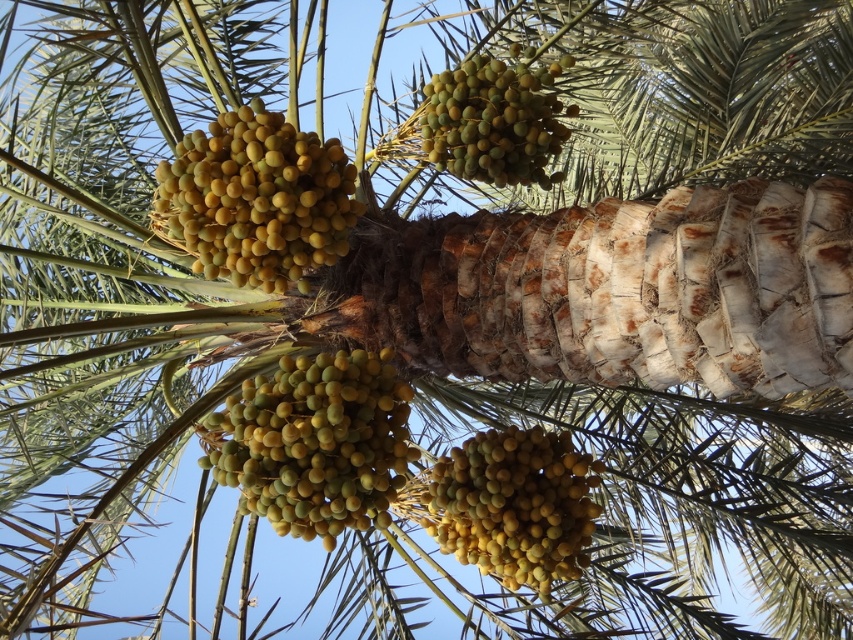
Is yellow matte fruit at center smaller than green matte dates at center?

Actually, yellow matte fruit at center might be larger than green matte dates at center.

Looking at this image, who is more distant from viewer, [410,445] or [463,141]?

Positioned behind is point [410,445].

The image size is (853, 640). In order to click on yellow matte fruit at center in this screenshot , I will do `click(314, 444)`.

Is the position of yellow matte dates at upper left less distant than that of yellow matte dates at center?

Yes.

Who is lower down, yellow matte dates at upper left or yellow matte dates at center?

yellow matte dates at center is lower down.

Identify the location of yellow matte dates at upper left. (x=257, y=198).

Is yellow matte fruit at center to the right of yellow matte dates at upper left from the viewer's perspective?

Yes, yellow matte fruit at center is to the right of yellow matte dates at upper left.

Who is more forward, (387, 432) or (268, 230)?

Point (387, 432) is more forward.

Where is `yellow matte fruit at center`? This screenshot has height=640, width=853. yellow matte fruit at center is located at coordinates (314, 444).